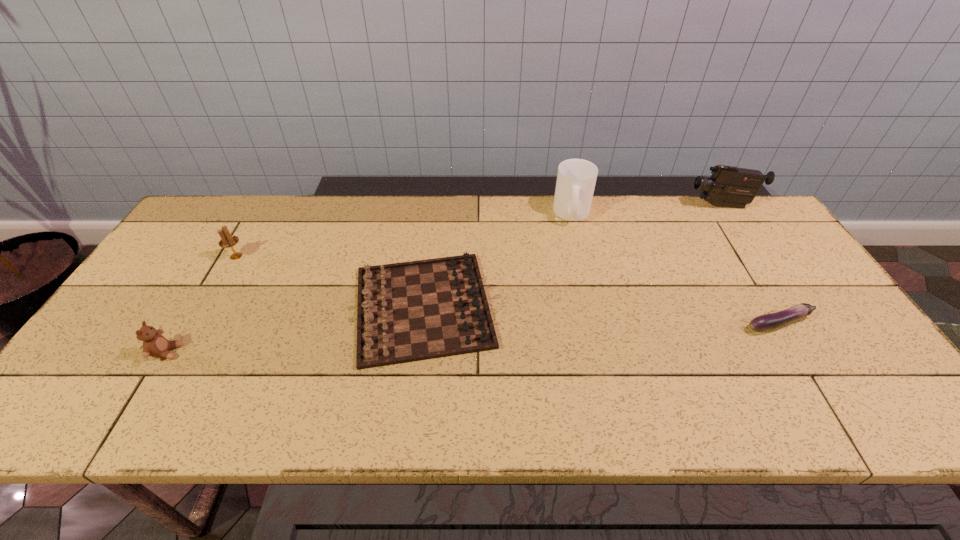
The image size is (960, 540). What are the coordinates of `object that is at the far right corner` in the screenshot? It's located at (730, 186).

Where is `vacant space at the far edge of the desktop`? vacant space at the far edge of the desktop is located at coordinates (252, 219).

Where is `free location at the near edge of the desktop`? This screenshot has width=960, height=540. free location at the near edge of the desktop is located at coordinates (473, 422).

At what (x,y) coordinates should I click in order to perform the action: click on vacant area at the left edge of the desktop. Please return your answer as a coordinate pair (x, y). Looking at the image, I should click on 115,362.

What are the coordinates of `vacant space at the far right corner of the desktop` in the screenshot? It's located at (756, 219).

Where is `vacant area between the camcorder and the third object from left to right`? Image resolution: width=960 pixels, height=540 pixels. vacant area between the camcorder and the third object from left to right is located at coordinates (572, 256).

This screenshot has width=960, height=540. I want to click on vacant space in between the candle holder and the third object from right to left, so click(x=404, y=235).

Image resolution: width=960 pixels, height=540 pixels. What are the coordinates of `free space that is in between the fourth object from left to right and the chessboard` in the screenshot? It's located at (497, 260).

Where is `free area in between the teddy bear and the fourth object from right to left`? This screenshot has width=960, height=540. free area in between the teddy bear and the fourth object from right to left is located at coordinates (295, 329).

Image resolution: width=960 pixels, height=540 pixels. What are the coordinates of `vacant space that is in between the mug and the camcorder` in the screenshot? It's located at (647, 210).